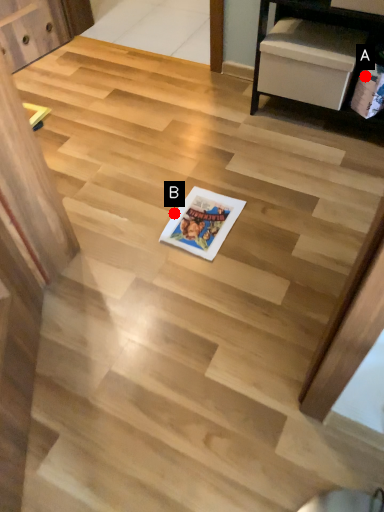
Question: Two points are circled on the image, labeled by A and B beside each circle. Which point appears closest to the camera in this image?

Choices:
 (A) A is closer
 (B) B is closer

Answer: (B)